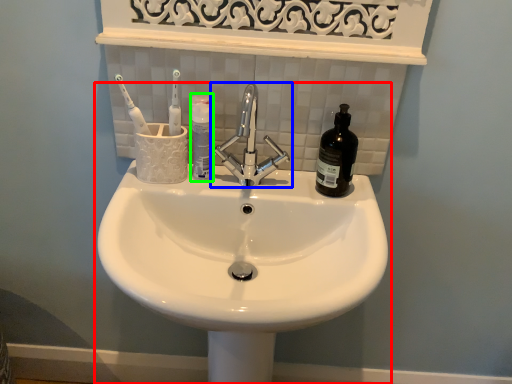
Question: Estimate the real-world distances between objects in this image. Which object is farther from sink (highlighted by a red box), tap (highlighted by a blue box) or mouthwash (highlighted by a green box)?

Choices:
 (A) tap
 (B) mouthwash

Answer: (B)